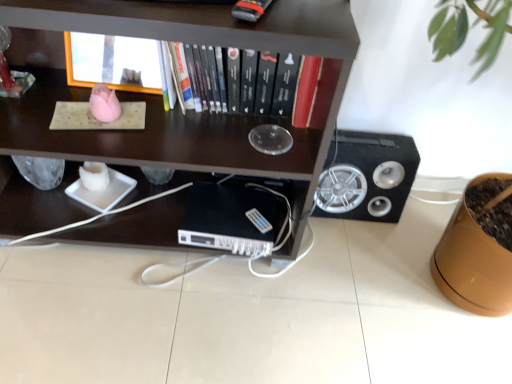
Question: Based on their sizes in the image, would you say black matte speaker at right is bigger or smaller than dark wood shelf at upper center, arranged as the 1th shelf when ordered from the bottom?

Choices:
 (A) small
 (B) big

Answer: (A)

Question: From a real-world perspective, is black matte speaker at right positioned above or below dark wood shelf at upper center, arranged as the 2th shelf when viewed from the top?

Choices:
 (A) below
 (B) above

Answer: (A)

Question: Estimate the real-world distances between objects in this image. Which object is closer to the wooden frame at upper center, the first shelf viewed from the top?

Choices:
 (A) black matte speaker at right
 (B) dark wood shelf at upper center, arranged as the 1th shelf when ordered from the bottom
 (C) black plastic computer at center
 (D) hardcover book at center

Answer: (D)

Question: Based on their relative distances, which object is farther from the wooden frame at upper center, which appears as the second shelf when ordered from the bottom?

Choices:
 (A) black matte speaker at right
 (B) black plastic computer at center
 (C) hardcover book at center
 (D) dark wood shelf at upper center, arranged as the 1th shelf when ordered from the bottom

Answer: (A)